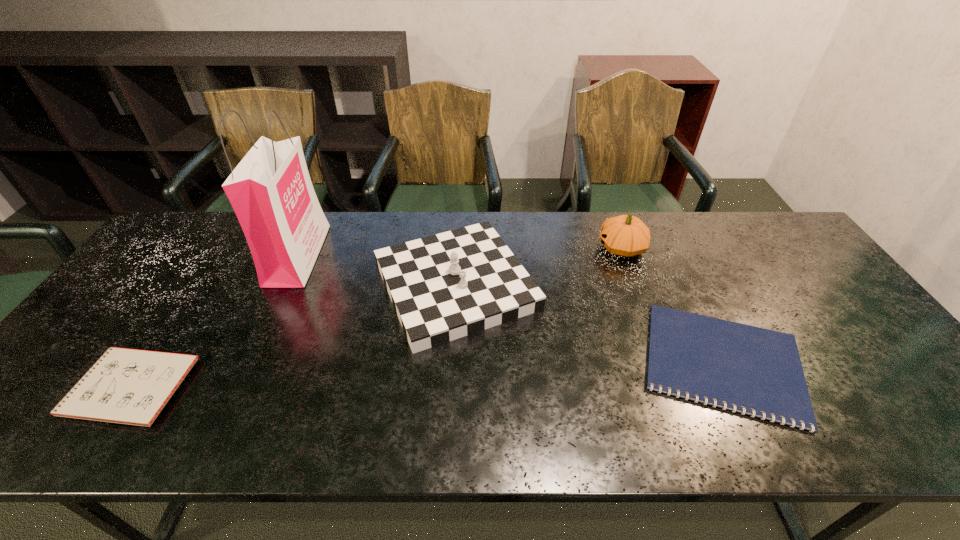
Where is `shopping bag`? shopping bag is located at coordinates coord(270,190).

Where is `the fourth object from right to left`? This screenshot has height=540, width=960. the fourth object from right to left is located at coordinates (270, 190).

Identify the location of gourd. This screenshot has height=540, width=960. (625, 235).

Where is `checkerboard`? checkerboard is located at coordinates (446, 286).

Image resolution: width=960 pixels, height=540 pixels. What are the coordinates of `the second shortest object` in the screenshot? It's located at (128, 386).

You are a GUI agent. You are given a task and a screenshot of the screen. Output one action in this format:
    pyautogui.click(x=<x>, y=<y>)
    Task: Click on the left notepad
    
    Given the screenshot: What is the action you would take?
    pyautogui.click(x=128, y=386)

Locate an element on the screen. The width and height of the screenshot is (960, 540). the right notepad is located at coordinates (754, 371).

The width and height of the screenshot is (960, 540). I want to click on the shorter notepad, so click(x=754, y=371).

This screenshot has width=960, height=540. In order to click on vacant space located on the front-facing side of the shopping bag in this screenshot , I will do `click(391, 255)`.

I want to click on free spot located 0.370m on the side of the gourd with the carved face, so click(x=479, y=248).